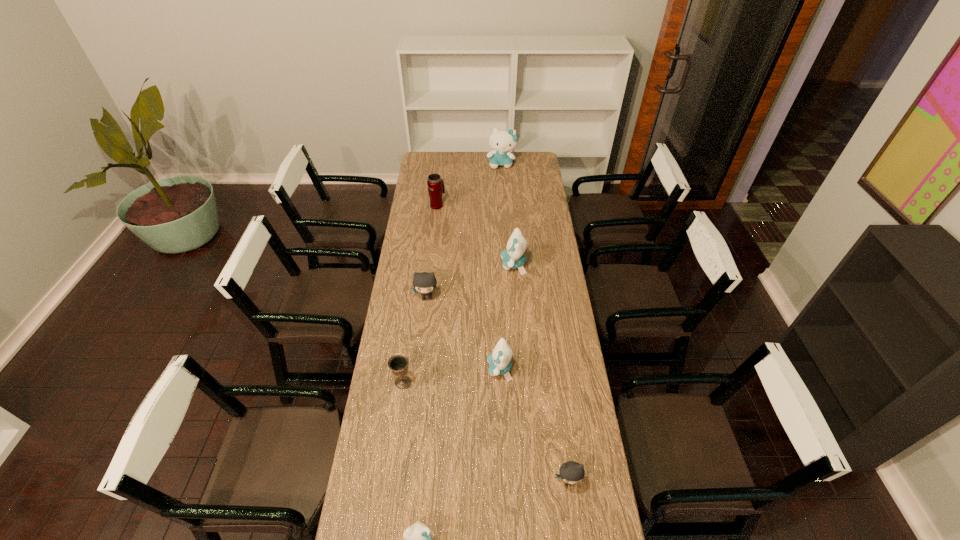
Identify the location of the farthest object. (502, 141).

The height and width of the screenshot is (540, 960). Find the location of `the farthest blue kitten`. the farthest blue kitten is located at coordinates (502, 141).

Where is `the third farthest object`? the third farthest object is located at coordinates (514, 257).

Where is `the second farthest blue kitten`? This screenshot has width=960, height=540. the second farthest blue kitten is located at coordinates (514, 257).

In order to click on the seventh nearest object in this screenshot , I will do `click(436, 188)`.

This screenshot has width=960, height=540. In order to click on thermos bottle in this screenshot , I will do `click(436, 188)`.

What are the coordinates of `the second nearest blue kitten` in the screenshot? It's located at (499, 361).

You are a GUI agent. You are given a task and a screenshot of the screen. Output one action in this format:
    pyautogui.click(x=<x>, y=<y>)
    Task: Click on the third nearest kitten
    This screenshot has width=960, height=540.
    Given the screenshot: What is the action you would take?
    pyautogui.click(x=499, y=361)

Where is `the fourth farthest object`? the fourth farthest object is located at coordinates (424, 283).

I want to click on the left gray kitten, so click(x=424, y=283).